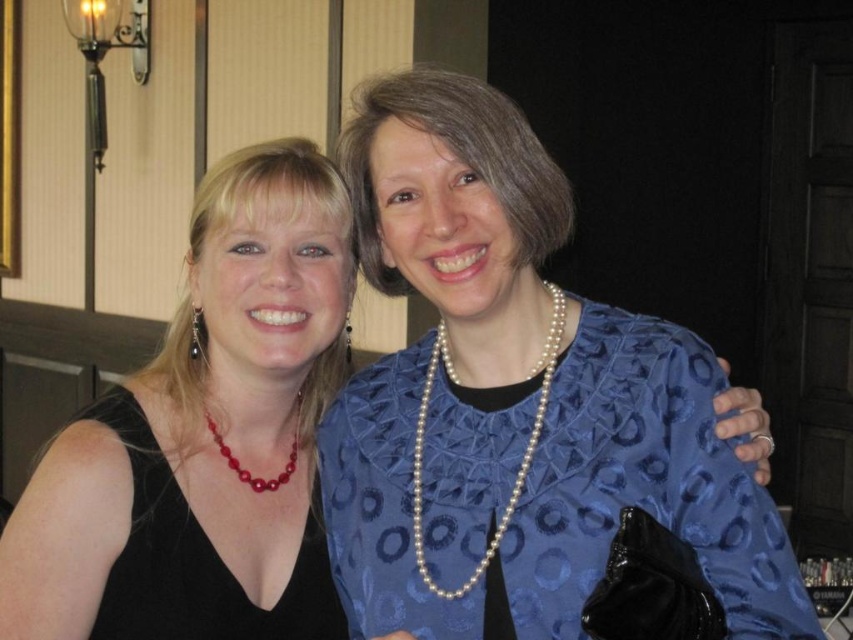
Who is more distant from viewer, (x=334, y=387) or (x=699, y=349)?

The point (x=334, y=387) is behind.

Between matte black dress at left and blue satin dress at center, which one appears on the left side from the viewer's perspective?

matte black dress at left is more to the left.

Is point (244, 429) farther from camera compared to point (506, 548)?

Yes, point (244, 429) is behind point (506, 548).

Where is `matte black dress at left`? Image resolution: width=853 pixels, height=640 pixels. matte black dress at left is located at coordinates (204, 436).

Does black silk dress at center appear under pearl necklace at center?

Actually, black silk dress at center is above pearl necklace at center.

Which is in front, point (258, 506) or point (433, 371)?

Point (433, 371)

You are a GUI agent. You are given a task and a screenshot of the screen. Output one action in this format:
    pyautogui.click(x=<x>, y=<y>)
    Task: Click on the black silk dress at center
    
    Given the screenshot: What is the action you would take?
    pyautogui.click(x=204, y=424)

Is blue satin dress at center shorter than red pearl necklace at center?

No, blue satin dress at center is not shorter than red pearl necklace at center.

Between blue satin dress at center and red pearl necklace at center, which one appears on the left side from the viewer's perspective?

red pearl necklace at center

Where is `blue satin dress at center`? This screenshot has height=640, width=853. blue satin dress at center is located at coordinates (560, 492).